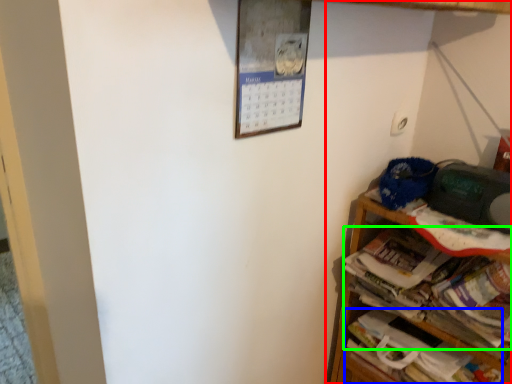
Question: Estimate the real-world distances between objects in this image. Which object is closer to shelf (highlighted by a red box), book (highlighted by a blue box) or magazine (highlighted by a green box)?

Choices:
 (A) book
 (B) magazine

Answer: (A)